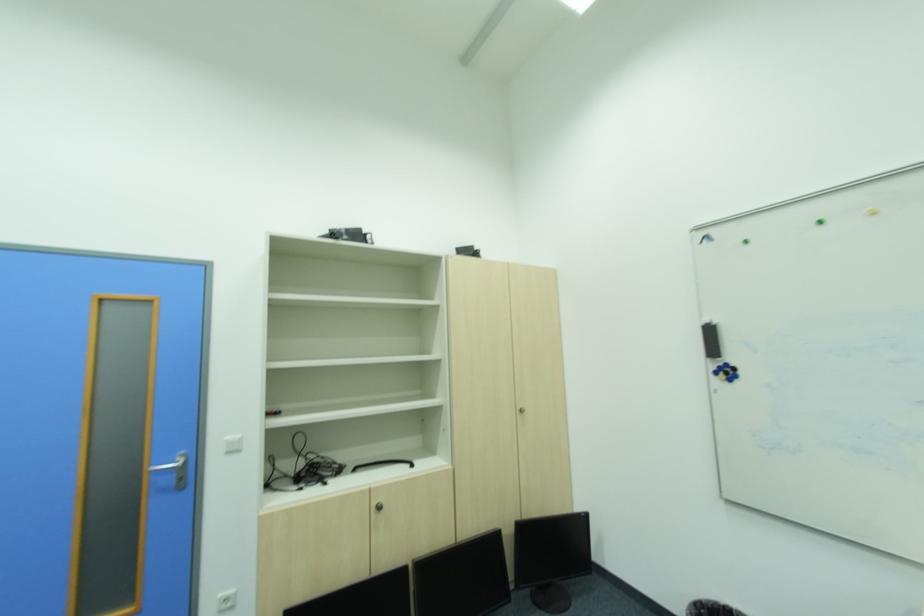
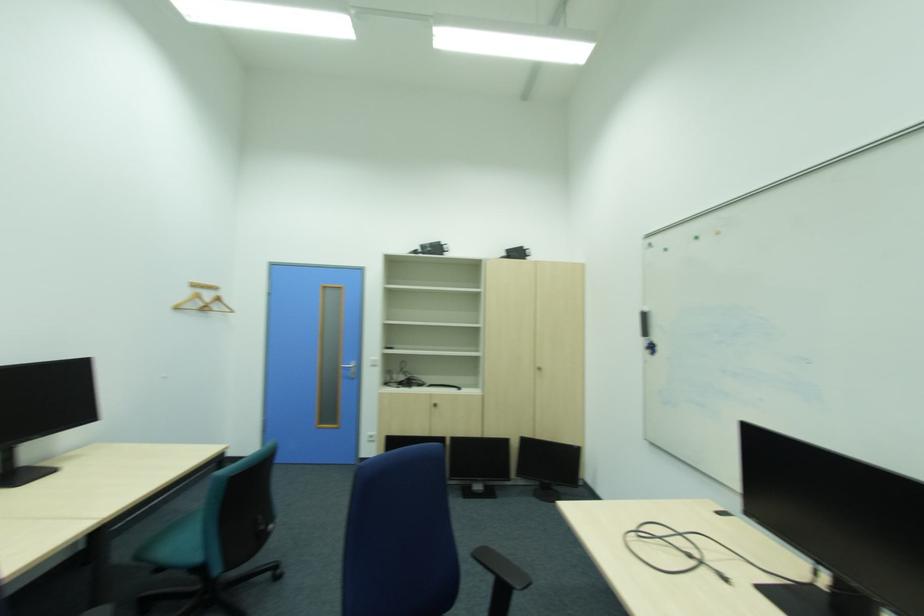
Which direction would the cameraman need to move to produce the second image?

The cameraman walked toward right, backward.